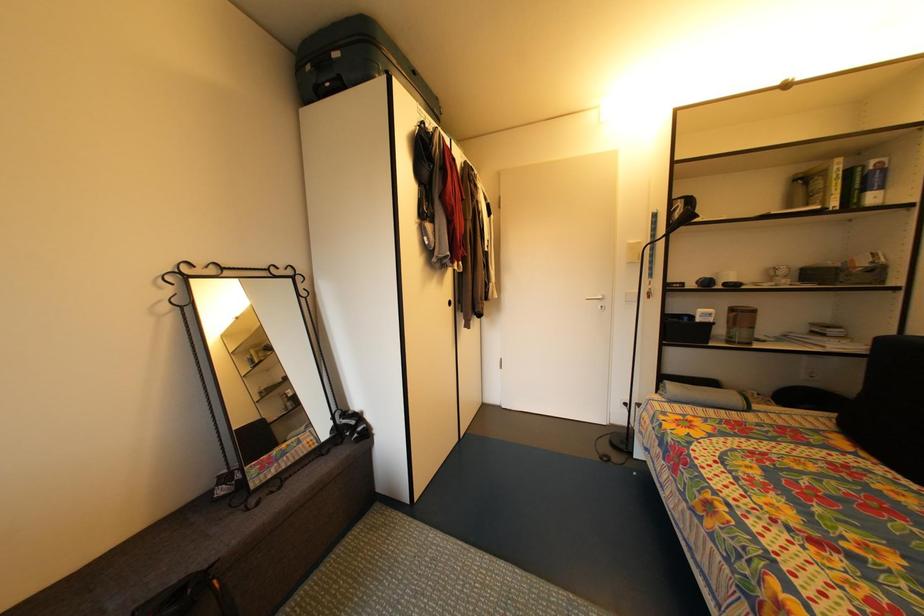
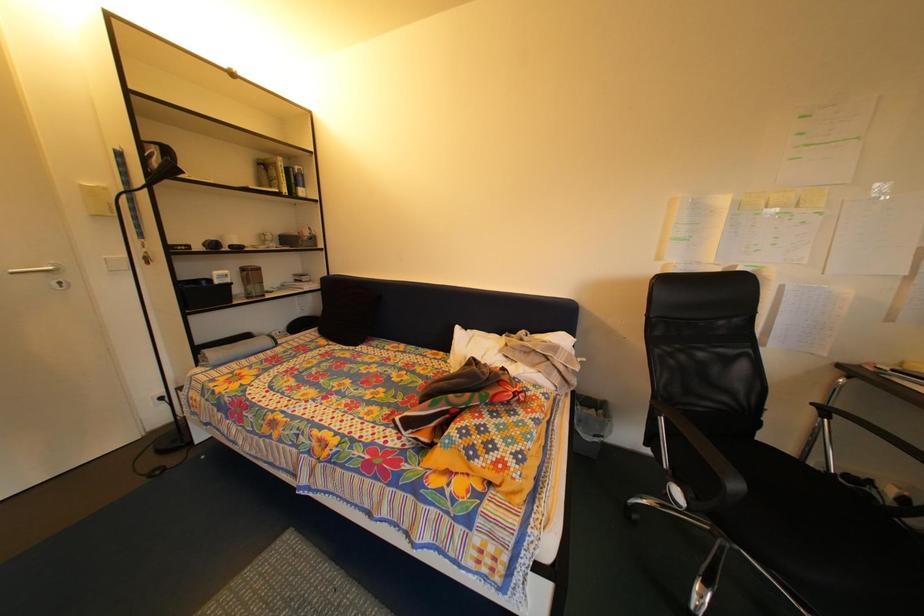
Question: The camera is either moving clockwise (left) or counter-clockwise (right) around the object. The first image is from the beginning of the video and the second image is from the end. Is the camera moving left or right when shooting the video?

Choices:
 (A) Left
 (B) Right

Answer: (A)